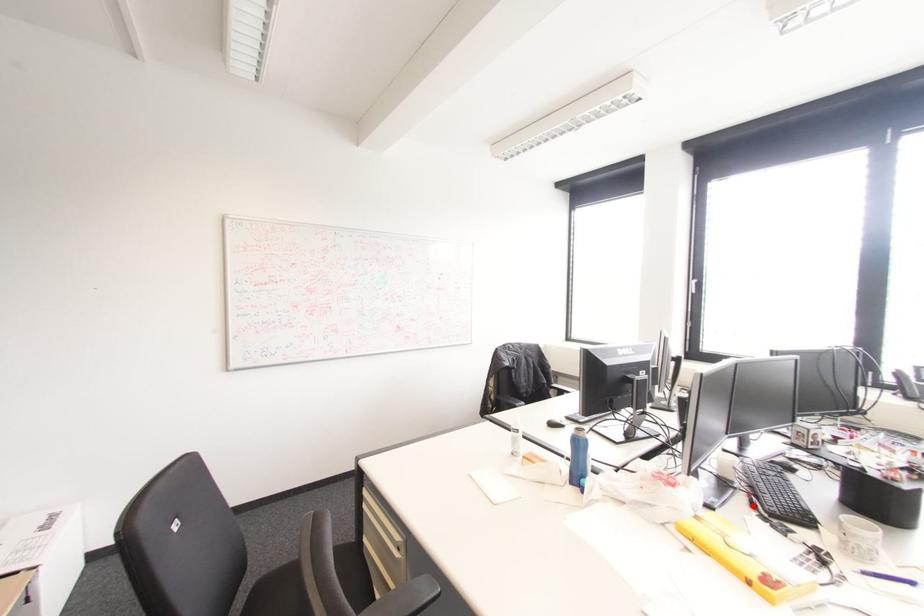
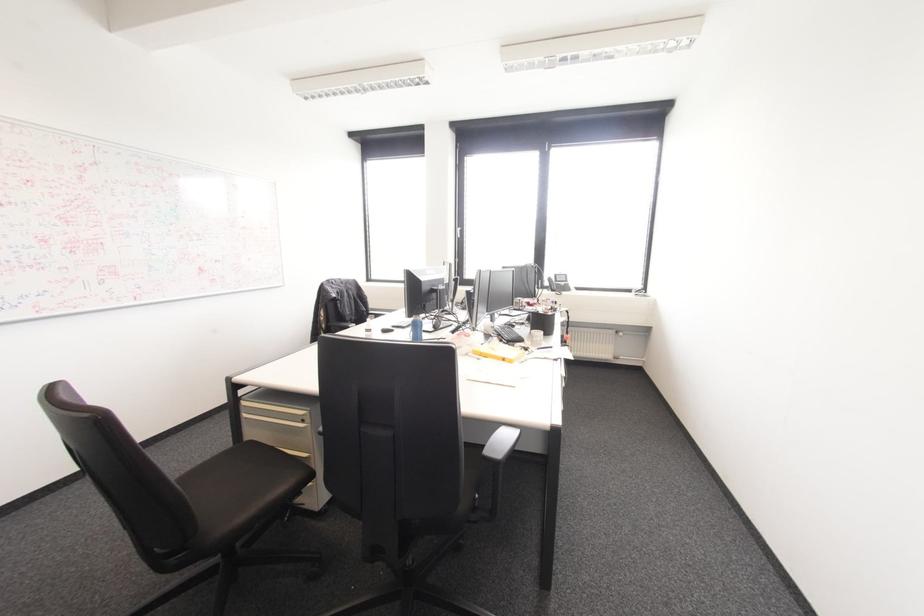
Question: I am providing you with two images of the same scene from different viewpoints. A red point is marked on the first image. Is the red point's position out of view in image 2?

Choices:
 (A) Yes
 (B) No

Answer: (B)